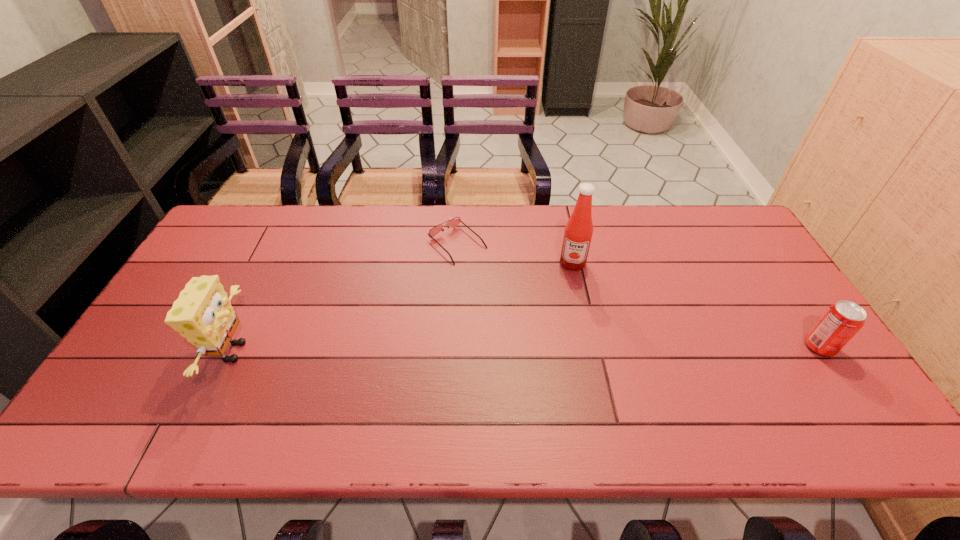
Locate an element on the screen. The height and width of the screenshot is (540, 960). free point located on the bridge of the second object from left to right is located at coordinates (499, 282).

At what (x,y) coordinates should I click in order to perform the action: click on free location located on the bridge of the second object from left to right. Please return your answer as a coordinate pair (x, y). The height and width of the screenshot is (540, 960). Looking at the image, I should click on (502, 285).

Find the location of a particular element. Image resolution: width=960 pixels, height=540 pixels. vacant area situated on the bridge of the second object from left to right is located at coordinates (562, 339).

The image size is (960, 540). What are the coordinates of `blank space located on the front-facing side of the condiment` in the screenshot? It's located at tap(562, 327).

In order to click on vacant space located on the front-facing side of the condiment in this screenshot , I will do `click(560, 339)`.

Locate an element on the screen. free space located on the front-facing side of the condiment is located at coordinates (564, 316).

The height and width of the screenshot is (540, 960). What are the coordinates of `object positioned at the far edge` in the screenshot? It's located at (452, 223).

This screenshot has height=540, width=960. What are the coordinates of `object that is at the near edge` in the screenshot? It's located at click(202, 314).

The width and height of the screenshot is (960, 540). In order to click on object present at the right edge in this screenshot , I will do `click(841, 321)`.

Identify the location of vacant space at the far edge of the desktop. (442, 226).